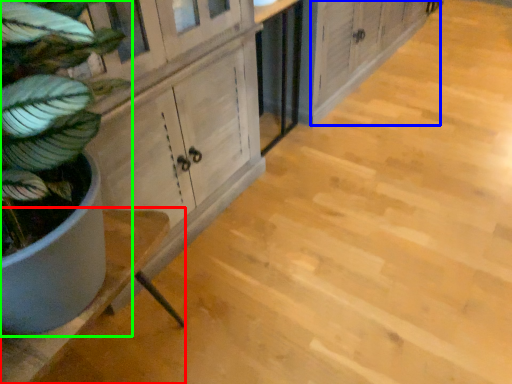
Question: Which object is positioned closest to counter (highlighted by a red box)? Select from cabinetry (highlighted by a blue box) and houseplant (highlighted by a green box).

Choices:
 (A) cabinetry
 (B) houseplant

Answer: (B)